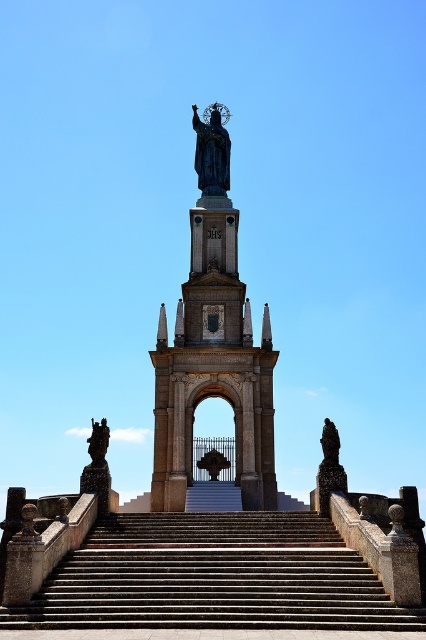
You are standing at the base of the monument and want to place a 100 meter long banner between the polished bronze statue at center and the bronze statue at right. Will the banner be long enough to stretch between them?

The polished bronze statue at center is 62.80 meters away from the bronze statue at right. The banner is 100 meters long, so it will be long enough to stretch between them with 37.20 meters remaining.

You are standing in front of the monument and want to take a photo. You notice two points marked in the scene, one at point coordinates point (209, 193) and another at point coordinates point (328, 490). Which point is closer to your camera lens?

Point (209, 193) is closer to the camera lens than point (328, 490) because it is further to the camera than the other point.

You are a tour guide leading a group to the polished bronze statue at center and the bronze statue at left. The group has a 100 meter rope. Can they tie the two statues together with the rope?

The polished bronze statue at center and the bronze statue at left are 62.57 meters apart from each other, so yes, the group can tie the two statues together with the 100 meter rope since it is longer than the distance between them.